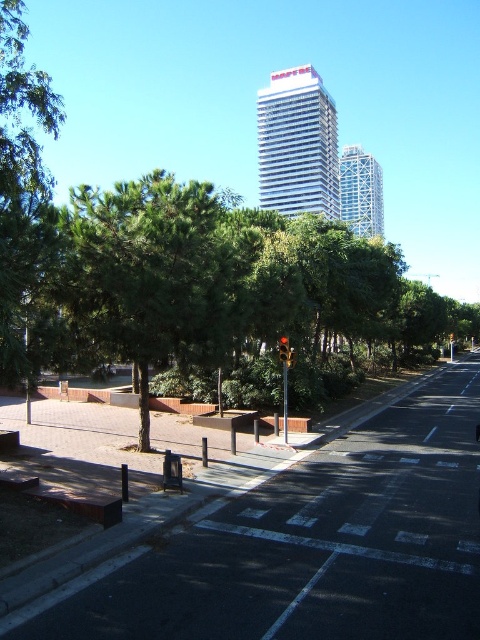
You are a delivery person needing to place a small package on an object that is lower to the ground. Which object between the wooden bench at lower left and the red glass traffic light at center would you choose?

The wooden bench at lower left has a lesser height compared to the red glass traffic light at center, so you should choose the wooden bench at lower left to place the small package since it is lower to the ground.

Consider the image. You are a pedestrian waiting at the crosswalk. You see the wooden bench at lower left and the red glass traffic light at center. Which object is closer to you as you wait?

The wooden bench at lower left is closer to you because it is in front of the red glass traffic light at center.